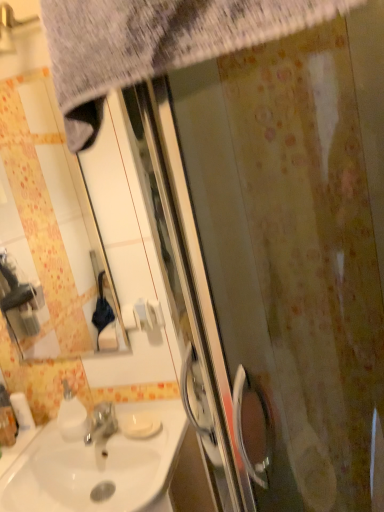
Question: Is matte white mirror at upper left to the left or to the right of white glossy sink at lower left in the image?

Choices:
 (A) left
 (B) right

Answer: (A)

Question: Is matte white mirror at upper left inside the boundaries of white glossy sink at lower left, or outside?

Choices:
 (A) inside
 (B) outside

Answer: (B)

Question: Based on their relative distances, which object is farther from the white glossy sink at lower left?

Choices:
 (A) white matte toilet paper at lower left
 (B) textured gray towel at upper left
 (C) white glossy soap dispenser at lower left
 (D) matte white mirror at upper left

Answer: (D)

Question: Based on their relative distances, which object is farther from the white glossy sink at lower left?

Choices:
 (A) white glossy soap dispenser at lower left
 (B) textured gray towel at upper left
 (C) white matte toilet paper at lower left
 (D) matte white mirror at upper left

Answer: (D)